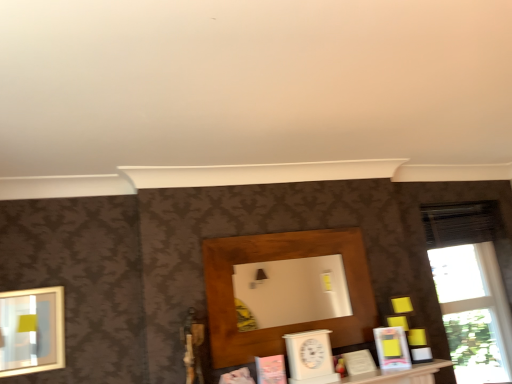
Describe the element at coordinates (237, 377) in the screenshot. I see `matte pink book at center, the fourth book positioned from the right` at that location.

This screenshot has width=512, height=384. What do you see at coordinates (32, 331) in the screenshot?
I see `matte gold picture frame at left` at bounding box center [32, 331].

Locate an element on the screen. This screenshot has width=512, height=384. white matte book at center, which appears as the 3th book when viewed from the left is located at coordinates (359, 362).

In order to face transparent glass window at right, should I rotate leftwards or rightwards?

It's best to rotate right around 26.390 degrees.

What are the coordinates of `pink matte book at center, which appears as the 2th book when viewed from the left` in the screenshot? It's located at (271, 370).

Considering the relative sizes of wooden shelf at center and matte gold picture frame at left in the image provided, is wooden shelf at center shorter than matte gold picture frame at left?

Incorrect, the height of wooden shelf at center does not fall short of that of matte gold picture frame at left.

From a real-world perspective, which is physically above, wooden shelf at center or matte gold picture frame at left?

From a 3D spatial view, wooden shelf at center is above.

Could you tell me if wooden shelf at center is turned towards matte gold picture frame at left?

No, wooden shelf at center does not turn towards matte gold picture frame at left.

From the image's perspective, who appears lower, wooden shelf at center or matte gold picture frame at left?

matte gold picture frame at left appears lower in the image.

From the image's perspective, is pink matte book at center, which is the third book in right-to-left order, on transparent glass window at right?

No.

Who is bigger, pink matte book at center, which is the third book in right-to-left order, or transparent glass window at right?

transparent glass window at right is bigger.

Does pink matte book at center, which appears as the 2th book when viewed from the left, contain transparent glass window at right?

That's incorrect, transparent glass window at right is not inside pink matte book at center, which appears as the 2th book when viewed from the left.

There is a transparent glass window at right. Find the location of `the 2nd book below it (from the image's perspective)`. the 2nd book below it (from the image's perspective) is located at coordinates (271, 370).

Is transparent glass window at right oriented away from pink matte book at center, which is the third book in right-to-left order?

No, pink matte book at center, which is the third book in right-to-left order, is not at the back of transparent glass window at right.

Identify the location of window behind the pink matte book at center, which appears as the 2th book when viewed from the left. This screenshot has width=512, height=384. (472, 287).

From the image's perspective, is transparent glass window at right located beneath pink matte book at center, which appears as the 2th book when viewed from the left?

No.

Does point (469, 280) come closer to viewer compared to point (272, 383)?

No, it is not.

Can you confirm if matte yellow book at lower right, acting as the fourth book starting from the left, is smaller than matte gold picture frame at left?

Indeed, matte yellow book at lower right, acting as the fourth book starting from the left, has a smaller size compared to matte gold picture frame at left.

What's the angular difference between matte yellow book at lower right, marked as the first book in a right-to-left arrangement, and matte gold picture frame at left's facing directions?

The angular difference between matte yellow book at lower right, marked as the first book in a right-to-left arrangement, and matte gold picture frame at left is 37.5 degrees.

From the image's perspective, is matte yellow book at lower right, marked as the first book in a right-to-left arrangement, beneath matte gold picture frame at left?

Correct, matte yellow book at lower right, marked as the first book in a right-to-left arrangement, appears lower than matte gold picture frame at left in the image.

Is matte yellow book at lower right, marked as the first book in a right-to-left arrangement, wider than matte gold picture frame at left?

In fact, matte yellow book at lower right, marked as the first book in a right-to-left arrangement, might be narrower than matte gold picture frame at left.

Considering the sizes of objects white matte book at center, the second book in the right-to-left sequence, and matte gold picture frame at left in the image provided, who is taller, white matte book at center, the second book in the right-to-left sequence, or matte gold picture frame at left?

Standing taller between the two is matte gold picture frame at left.

Is white matte book at center, the second book in the right-to-left sequence, surrounding matte gold picture frame at left?

No.

In the image, there is a white matte book at center, which appears as the 3th book when viewed from the left. Where is `picture frame above it (from the image's perspective)`? picture frame above it (from the image's perspective) is located at coordinates (32, 331).

Could you measure the distance between white matte book at center, the second book in the right-to-left sequence, and matte gold picture frame at left?

white matte book at center, the second book in the right-to-left sequence, is 4.78 feet from matte gold picture frame at left.

Is there a large distance between white wooden clock at lower center and wooden shelf at center?

No, white wooden clock at lower center is not far from wooden shelf at center.

From the image's perspective, is white wooden clock at lower center above wooden shelf at center?

No, from the image's perspective, white wooden clock at lower center is not above wooden shelf at center.

Looking at this image, is white wooden clock at lower center not inside wooden shelf at center?

Indeed, white wooden clock at lower center is completely outside wooden shelf at center.

Identify the location of shelf located on the left of white wooden clock at lower center. (279, 259).

Considering the positions of objects matte yellow book at lower right, marked as the first book in a right-to-left arrangement, and matte pink book at center, the fourth book positioned from the right, in the image provided, who is in front, matte yellow book at lower right, marked as the first book in a right-to-left arrangement, or matte pink book at center, the fourth book positioned from the right,?

matte pink book at center, the fourth book positioned from the right.

Which object is positioned more to the left, matte yellow book at lower right, acting as the fourth book starting from the left, or matte pink book at center, acting as the 1th book starting from the left?

matte pink book at center, acting as the 1th book starting from the left.

Is point (400, 360) closer or farther from the camera than point (247, 381)?

Clearly, point (400, 360) is more distant from the camera than point (247, 381).

Is matte yellow book at lower right, acting as the fourth book starting from the left, aimed at matte pink book at center, the fourth book positioned from the right?

No, matte yellow book at lower right, acting as the fourth book starting from the left, is not aimed at matte pink book at center, the fourth book positioned from the right.

Locate an element on the screen. shelf that is on the right side of matte gold picture frame at left is located at coordinates (279, 259).

Locate an element on the screen. This screenshot has height=384, width=512. window above the pink matte book at center, which is the third book in right-to-left order (from the image's perspective) is located at coordinates (472, 287).

When comparing their distances from matte pink book at center, acting as the 1th book starting from the left, does white matte book at center, which appears as the 3th book when viewed from the left, or transparent glass window at right seem closer?

white matte book at center, which appears as the 3th book when viewed from the left, is closer to matte pink book at center, acting as the 1th book starting from the left.

Looking at this image, looking at the image, which one is located closer to white matte book at center, the second book in the right-to-left sequence, transparent glass window at right or matte yellow book at lower right, acting as the fourth book starting from the left?

matte yellow book at lower right, acting as the fourth book starting from the left, lies closer to white matte book at center, the second book in the right-to-left sequence, than the other object.

Based on their spatial positions, is matte gold picture frame at left or pink matte book at center, which appears as the 2th book when viewed from the left, closer to wooden shelf at center?

pink matte book at center, which appears as the 2th book when viewed from the left, is closer to wooden shelf at center.

When comparing their distances from white matte book at center, which appears as the 3th book when viewed from the left, does transparent glass window at right or matte gold picture frame at left seem closer?

transparent glass window at right.

Looking at the image, which one is located further to matte yellow book at lower right, marked as the first book in a right-to-left arrangement, wooden shelf at center or matte pink book at center, the fourth book positioned from the right?

Based on the image, matte pink book at center, the fourth book positioned from the right, appears to be further to matte yellow book at lower right, marked as the first book in a right-to-left arrangement.

Looking at the image, which one is located closer to transparent glass window at right, white matte book at center, which appears as the 3th book when viewed from the left, or white wooden clock at lower center?

white matte book at center, which appears as the 3th book when viewed from the left, is positioned closer to the anchor transparent glass window at right.

When comparing their distances from matte pink book at center, the fourth book positioned from the right, does matte yellow book at lower right, acting as the fourth book starting from the left, or wooden shelf at center seem closer?

The object closer to matte pink book at center, the fourth book positioned from the right, is wooden shelf at center.

Which object lies nearer to the anchor point white wooden clock at lower center, white matte book at center, which appears as the 3th book when viewed from the left, or matte pink book at center, the fourth book positioned from the right?

The object closer to white wooden clock at lower center is white matte book at center, which appears as the 3th book when viewed from the left.

You are a GUI agent. You are given a task and a screenshot of the screen. Output one action in this format:
    pyautogui.click(x=<x>, y=<y>)
    Task: Click on the clock situated between matte pink book at center, the fourth book positioned from the right, and white matte book at center, which appears as the 3th book when viewed from the left, from left to right
    
    Given the screenshot: What is the action you would take?
    pyautogui.click(x=310, y=357)

Identify the location of clock located between matte gold picture frame at left and white matte book at center, which appears as the 3th book when viewed from the left, in the left-right direction. (310, 357).

At what (x,y) coordinates should I click in order to perform the action: click on book between pink matte book at center, which appears as the 2th book when viewed from the left, and matte yellow book at lower right, acting as the fourth book starting from the left. Please return your answer as a coordinate pair (x, y). The image size is (512, 384). Looking at the image, I should click on point(359,362).

At what (x,y) coordinates should I click in order to perform the action: click on clock between wooden shelf at center and white matte book at center, which appears as the 3th book when viewed from the left, in the up-down direction. Please return your answer as a coordinate pair (x, y). This screenshot has width=512, height=384. Looking at the image, I should click on (310, 357).